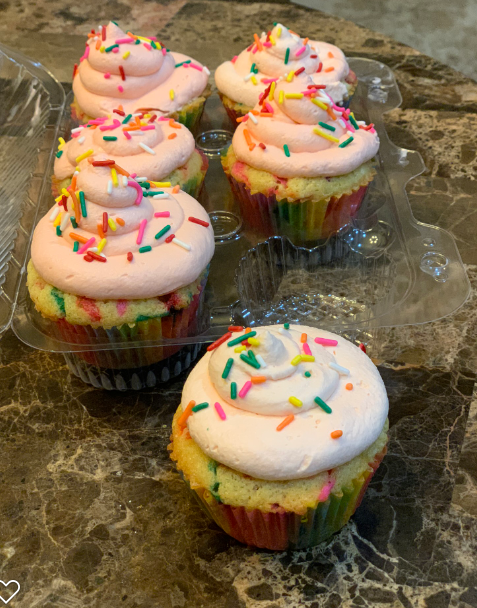
The height and width of the screenshot is (608, 477). I want to click on floor, so click(x=334, y=4), click(x=394, y=5), click(x=454, y=42), click(x=427, y=42).